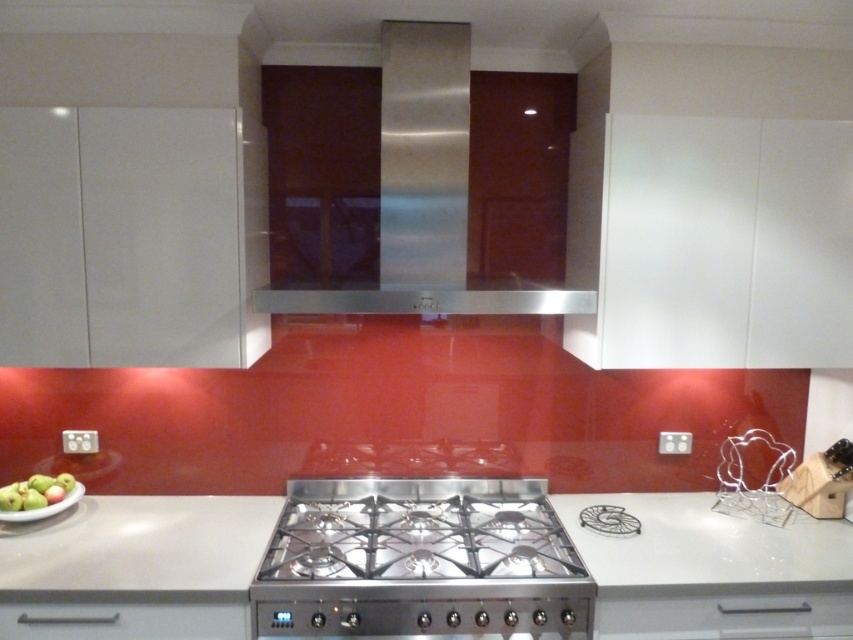
In the scene shown: Can you confirm if stainless steel gas stove at center is shorter than green matte apple at lower left?

In fact, stainless steel gas stove at center may be taller than green matte apple at lower left.

Based on the photo, does stainless steel gas stove at center appear under green matte apple at lower left?

Correct, stainless steel gas stove at center is located below green matte apple at lower left.

Locate an element on the screen. The height and width of the screenshot is (640, 853). stainless steel gas stove at center is located at coordinates (421, 561).

Locate an element on the screen. stainless steel gas stove at center is located at coordinates (421, 561).

Identify the location of stainless steel exhaust hood at center. (422, 195).

Is point (440, 202) positioned before point (12, 508)?

Yes, point (440, 202) is closer to viewer.

Describe the element at coordinates (422, 195) in the screenshot. I see `stainless steel exhaust hood at center` at that location.

You are a GUI agent. You are given a task and a screenshot of the screen. Output one action in this format:
    pyautogui.click(x=<x>, y=<y>)
    Task: Click on the stainless steel exhaust hood at center
    The image size is (853, 640).
    Given the screenshot: What is the action you would take?
    pyautogui.click(x=422, y=195)

Between satin white countertop at center and green matte apple at lower left, which one has more height?

With more height is satin white countertop at center.

The height and width of the screenshot is (640, 853). What do you see at coordinates (136, 566) in the screenshot?
I see `satin white countertop at center` at bounding box center [136, 566].

This screenshot has width=853, height=640. Identify the location of satin white countertop at center. (136, 566).